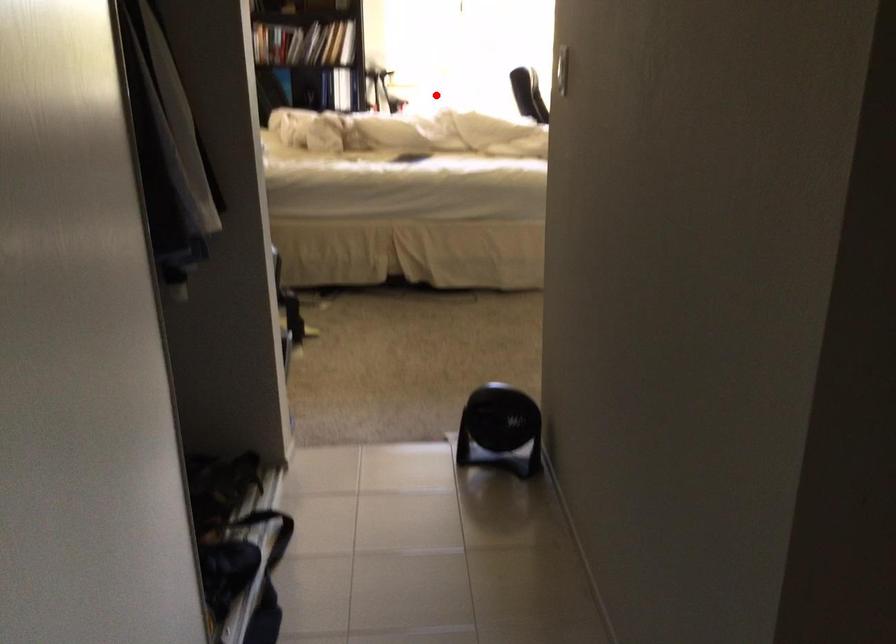
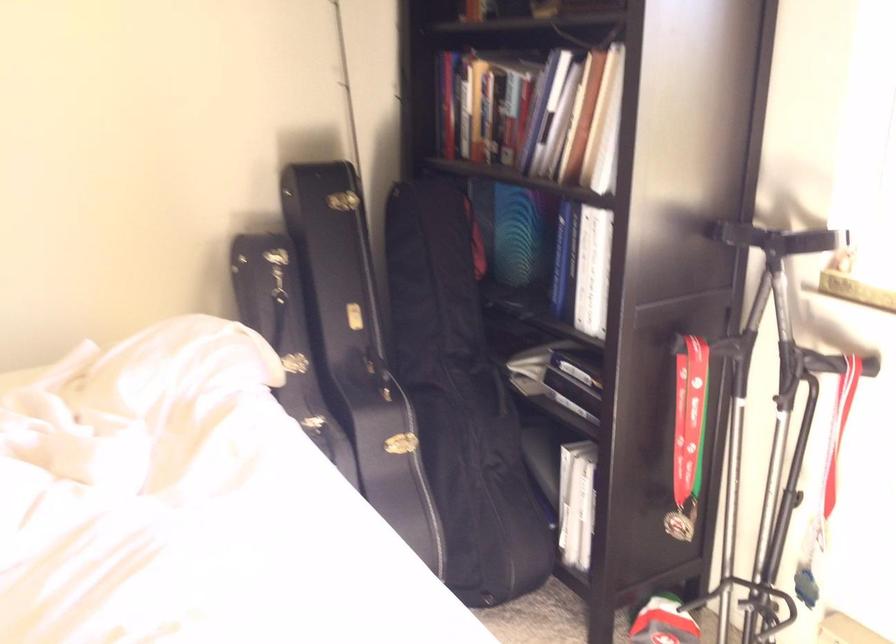
Question: I am providing you with two images of the same scene from different viewpoints. A red point is marked on the first image. Is the red point's position out of view in image 2?

Choices:
 (A) Yes
 (B) No

Answer: (B)